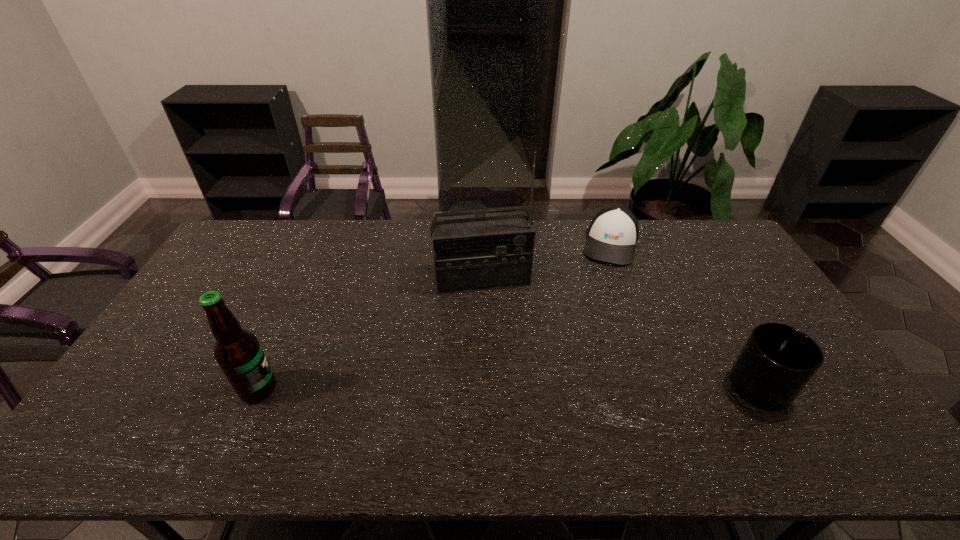
At what (x,y) coordinates should I click in order to perform the action: click on free point between the tallest object and the second shortest object. Please return your answer as a coordinate pair (x, y). The image size is (960, 540). Looking at the image, I should click on (625, 333).

The width and height of the screenshot is (960, 540). I want to click on free space between the tallest object and the third object from left to right, so click(x=546, y=261).

The width and height of the screenshot is (960, 540). Find the location of `vacant area that lies between the shortest object and the mug`. vacant area that lies between the shortest object and the mug is located at coordinates (689, 315).

This screenshot has height=540, width=960. Identify the location of empty space between the cap and the mug. [689, 315].

This screenshot has width=960, height=540. Identify the location of vacant space in between the tallest object and the rightmost object. pyautogui.click(x=625, y=333).

I want to click on free space between the radio receiver and the leftmost object, so click(371, 334).

Identify which object is the third closest to the leftmost object. Please provide its 2D coordinates. Your answer should be formatted as a tuple, i.e. [(x, y)], where the tuple contains the x and y coordinates of a point satisfying the conditions above.

[(777, 361)]

Identify which object is the second nearest to the radio receiver. Please provide its 2D coordinates. Your answer should be formatted as a tuple, i.e. [(x, y)], where the tuple contains the x and y coordinates of a point satisfying the conditions above.

[(238, 352)]

Image resolution: width=960 pixels, height=540 pixels. I want to click on vacant space that satisfies the following two spatial constraints: 1. on the front side of the rightmost object; 2. with the handle on the side of the third object from left to right, so click(x=662, y=387).

You are a GUI agent. You are given a task and a screenshot of the screen. Output one action in this format:
    pyautogui.click(x=<x>, y=<y>)
    Task: Click on the free spot that satisfies the following two spatial constraints: 1. on the front side of the third tallest object; 2. with the handle on the side of the shortest object
    The image size is (960, 540).
    Given the screenshot: What is the action you would take?
    pyautogui.click(x=662, y=387)